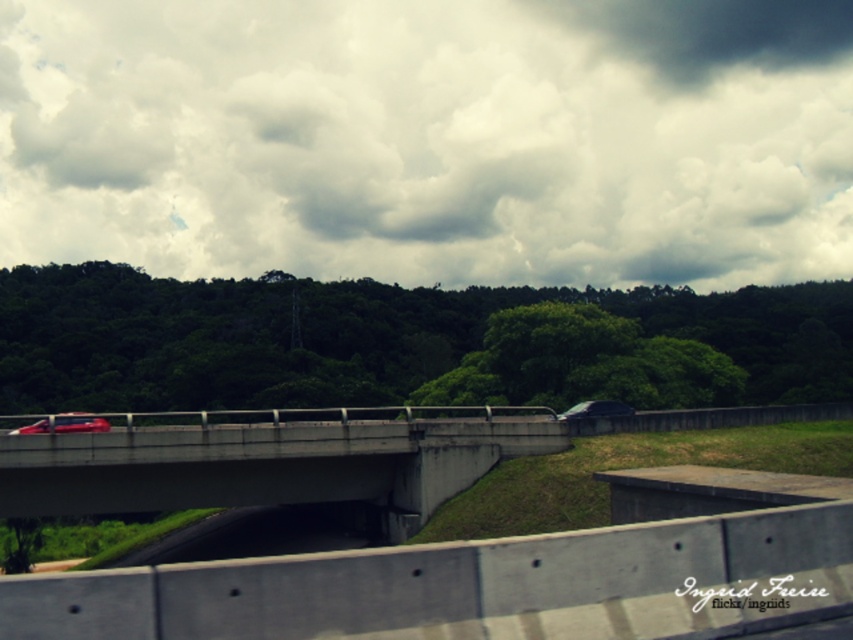
Question: Considering the real-world distances, which object is farthest from the concrete bridge at center?

Choices:
 (A) shiny red car at center
 (B) cloudy sky at upper center

Answer: (B)

Question: Is shiny red car at center in front of smokey gray car at center?

Choices:
 (A) no
 (B) yes

Answer: (B)

Question: Considering the real-world distances, which object is farthest from the smokey gray car at center?

Choices:
 (A) shiny red car at center
 (B) concrete bridge at center

Answer: (A)

Question: Is concrete bridge at center below shiny red car at center?

Choices:
 (A) no
 (B) yes

Answer: (B)

Question: Which object is the closest to the shiny red car at center?

Choices:
 (A) smokey gray car at center
 (B) cloudy sky at upper center
 (C) concrete bridge at center

Answer: (C)

Question: Does concrete bridge at center have a greater width compared to shiny red car at center?

Choices:
 (A) yes
 (B) no

Answer: (A)